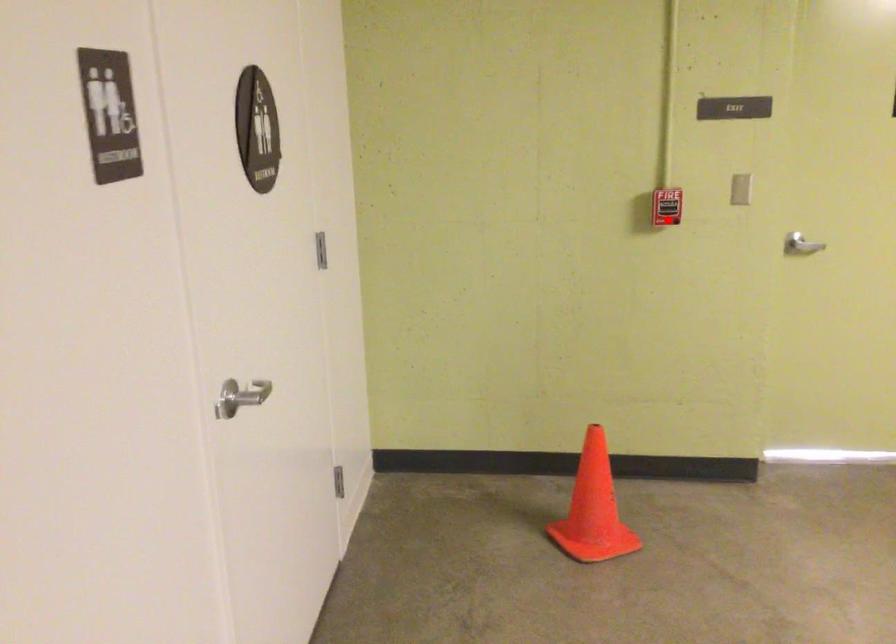
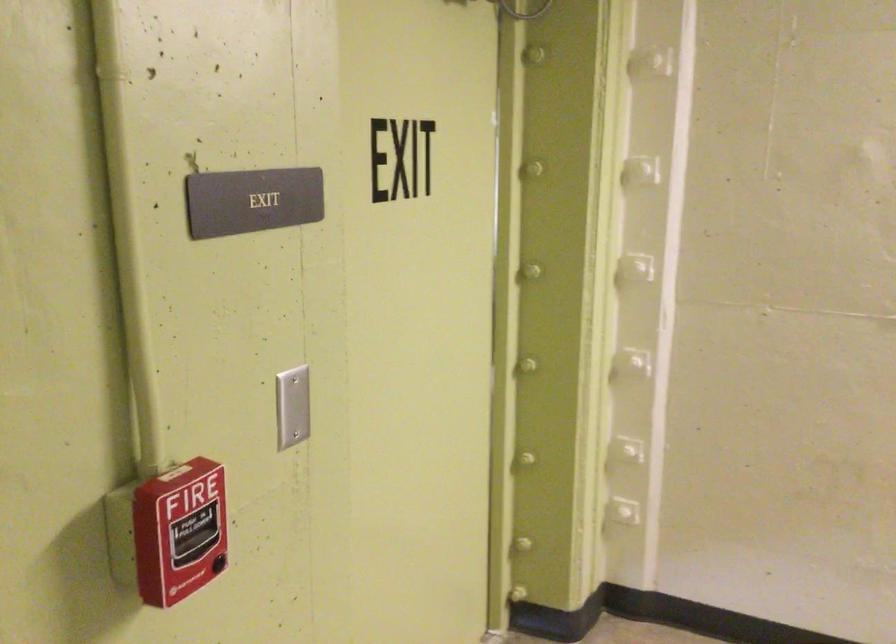
Question: A red point is marked in image1. In image2, is the corresponding 3D point closer to the camera or farther? Reply with the corresponding letter.

Choices:
 (A) The corresponding 3D point is closer.
 (B) The corresponding 3D point is farther.

Answer: (A)